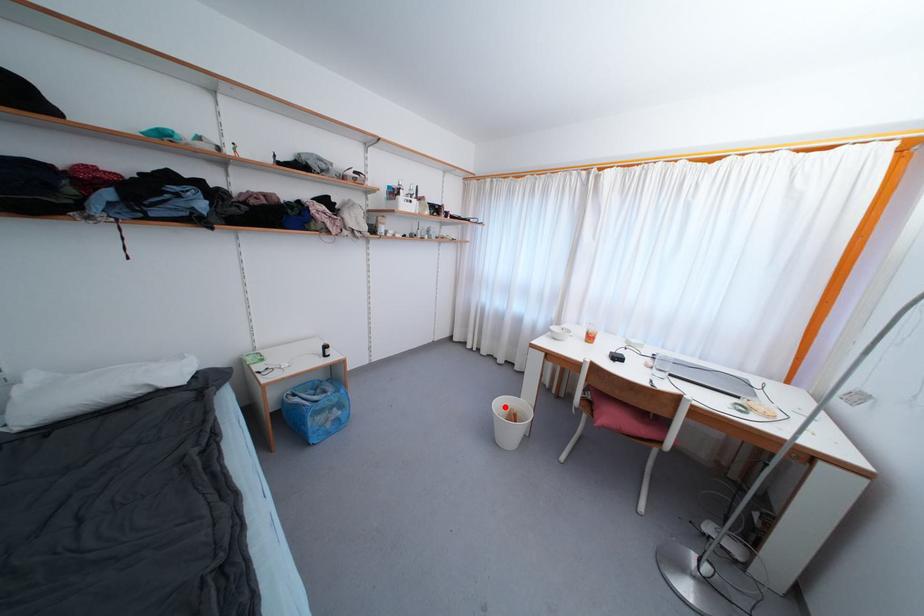
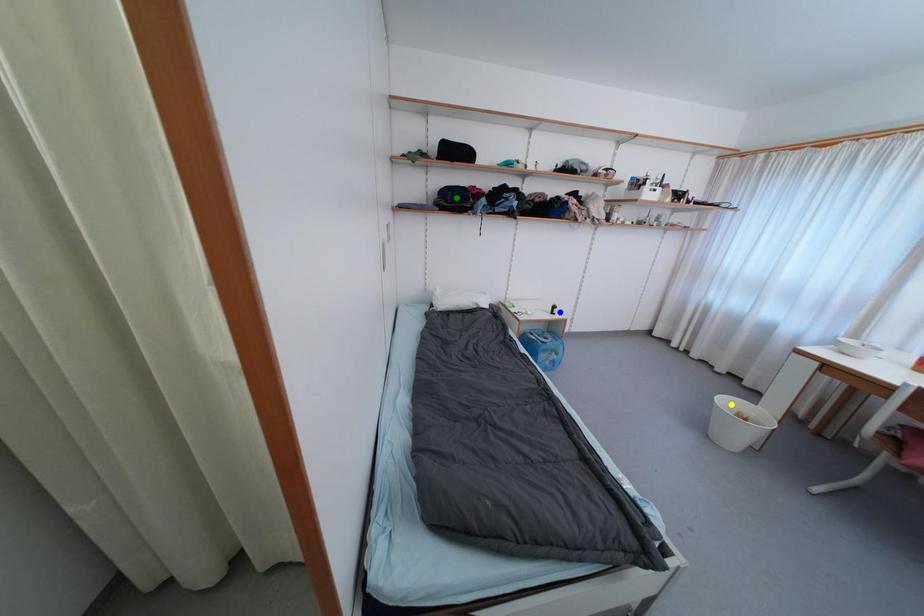
Question: I am providing you with two images of the same scene from different viewpoints. A red point is marked on the first image. You are given multiple points on the second image. Which mark in image 2 goes with the point in image 1?

Choices:
 (A) yellow point
 (B) green point
 (C) blue point

Answer: (A)